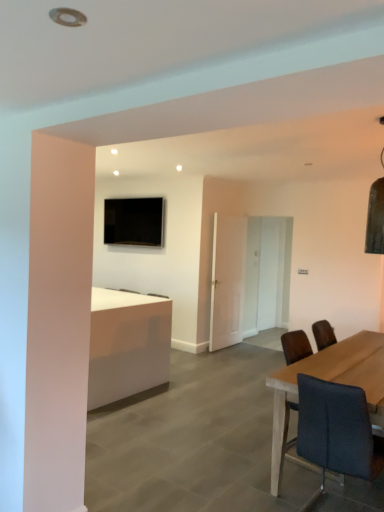
Question: From a real-world perspective, is dark gray fabric chair at right over black glossy tv at upper center?

Choices:
 (A) yes
 (B) no

Answer: (B)

Question: Is dark gray fabric chair at right not close to black glossy tv at upper center?

Choices:
 (A) yes
 (B) no

Answer: (A)

Question: Can you confirm if dark gray fabric chair at right is taller than black glossy tv at upper center?

Choices:
 (A) yes
 (B) no

Answer: (A)

Question: From the image's perspective, is dark gray fabric chair at right below black glossy tv at upper center?

Choices:
 (A) yes
 (B) no

Answer: (A)

Question: Is dark gray fabric chair at right to the right of black glossy tv at upper center from the viewer's perspective?

Choices:
 (A) yes
 (B) no

Answer: (A)

Question: Does dark gray fabric chair at right lie in front of black glossy tv at upper center?

Choices:
 (A) yes
 (B) no

Answer: (A)

Question: Can you see black glossy tv at upper center touching dark gray fabric chair at right?

Choices:
 (A) no
 (B) yes

Answer: (A)

Question: Can you confirm if black glossy tv at upper center is wider than dark gray fabric chair at right?

Choices:
 (A) no
 (B) yes

Answer: (A)

Question: Is black glossy tv at upper center positioned behind dark gray fabric chair at right?

Choices:
 (A) no
 (B) yes

Answer: (B)

Question: Would you say black glossy tv at upper center is a long distance from dark gray fabric chair at right?

Choices:
 (A) no
 (B) yes

Answer: (B)

Question: From the image's perspective, would you say black glossy tv at upper center is shown under dark gray fabric chair at right?

Choices:
 (A) yes
 (B) no

Answer: (B)

Question: Considering the relative sizes of black glossy tv at upper center and dark gray fabric chair at right in the image provided, is black glossy tv at upper center shorter than dark gray fabric chair at right?

Choices:
 (A) yes
 (B) no

Answer: (A)

Question: Is white glossy door at center, the 1th glass door in the right-to-left sequence, taller than black glossy tv at upper center?

Choices:
 (A) no
 (B) yes

Answer: (B)